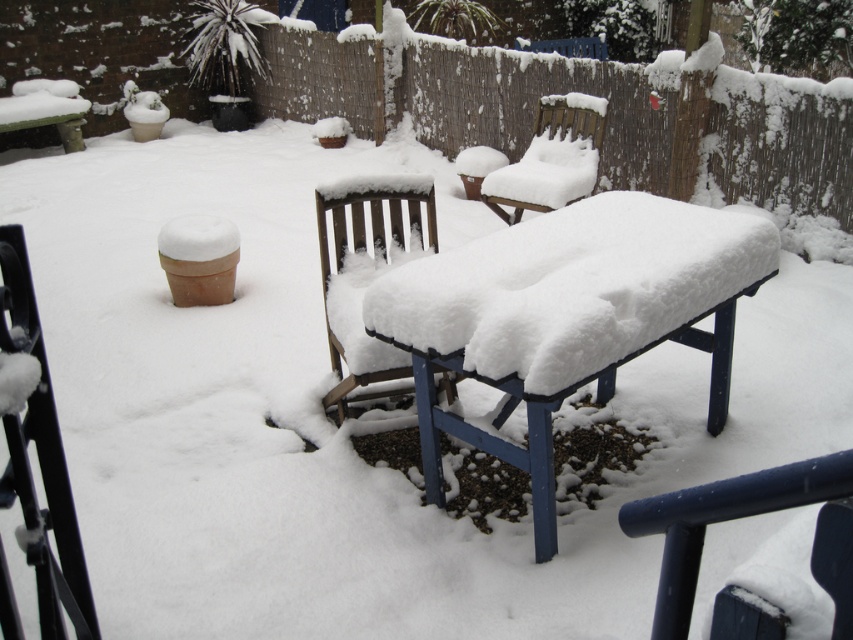
Question: Which is nearer to the black metal chair at lower left?

Choices:
 (A) brown wooden fence at upper center
 (B) wooden chair at center
 (C) wooden chair at upper center
 (D) blue painted wood picnic table at center

Answer: (B)

Question: Does blue painted wood picnic table at center have a smaller size compared to wooden chair at upper center?

Choices:
 (A) no
 (B) yes

Answer: (A)

Question: Which object appears farthest from the camera in this image?

Choices:
 (A) wooden chair at center
 (B) wooden chair at upper center
 (C) blue painted wood picnic table at center
 (D) brown wooden fence at upper center

Answer: (D)

Question: In this image, where is blue painted wood picnic table at center located relative to black metal chair at lower left?

Choices:
 (A) right
 (B) left

Answer: (A)

Question: Among these points, which one is nearest to the camera?

Choices:
 (A) (0, 256)
 (B) (498, 198)
 (C) (375, 312)
 (D) (727, 136)

Answer: (A)

Question: Is blue painted wood picnic table at center above wooden chair at center?

Choices:
 (A) yes
 (B) no

Answer: (B)